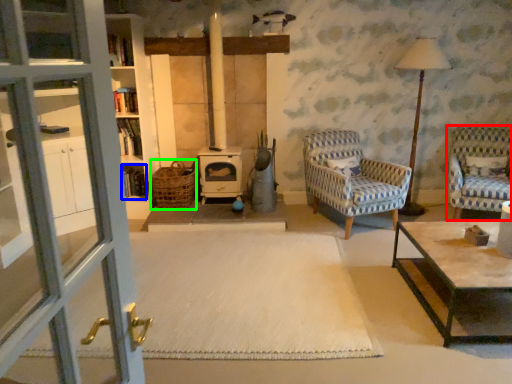
Question: Estimate the real-world distances between objects in this image. Which object is closer to chair (highlighted by a red box), shelf (highlighted by a blue box) or basket (highlighted by a green box)?

Choices:
 (A) shelf
 (B) basket

Answer: (B)